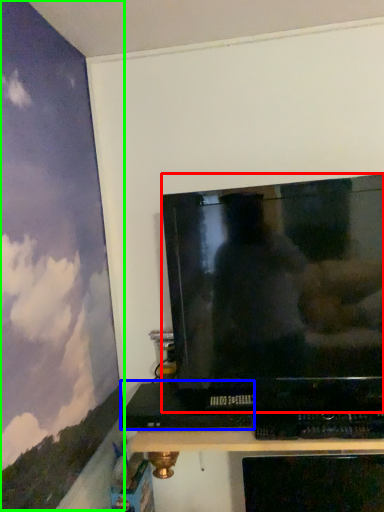
Question: Which is farther away from television (highlighted by a red box)? computer (highlighted by a blue box) or backdrop (highlighted by a green box)?

Choices:
 (A) computer
 (B) backdrop

Answer: (B)